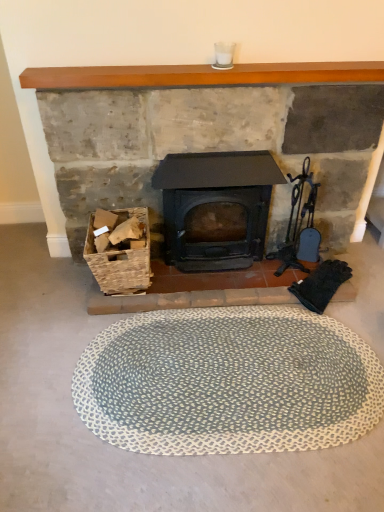
Locate an element on the screen. The image size is (384, 512). vacant region in front of matte black wood burning stove at center is located at coordinates (219, 311).